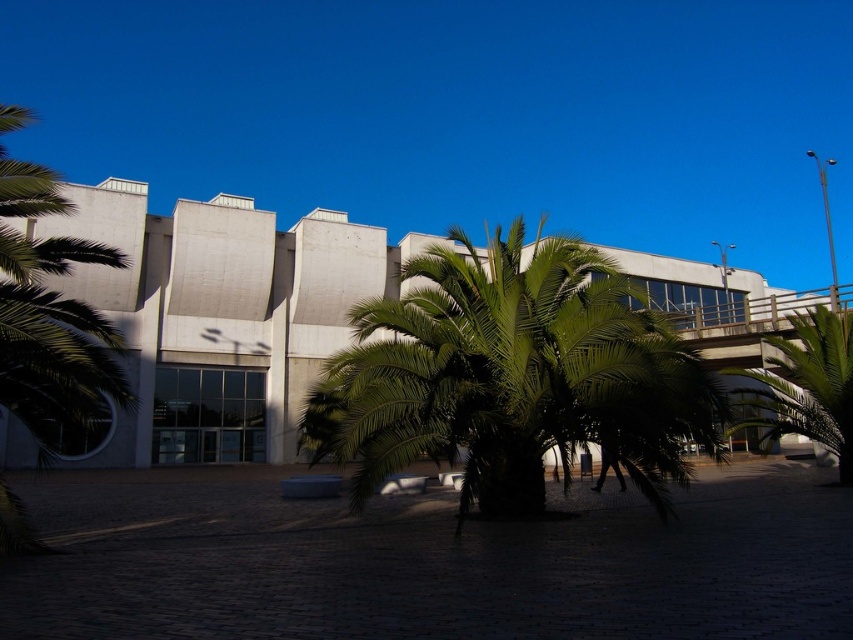
You are standing in front of the modern building and want to take a photo of both the green leafy palm tree at center and the green leafy palm tree at right. Which palm tree is positioned higher in the frame?

The green leafy palm tree at center is located above the green leafy palm tree at right, so it will appear higher in the frame.

You are standing in front of the modern building and want to take a photo of the green leafy palm tree at center and the green leafy palm tree at right. Which palm tree will appear closer to you in the photo?

The green leafy palm tree at center will appear closer to you in the photo because it is positioned in front of the green leafy palm tree at right.